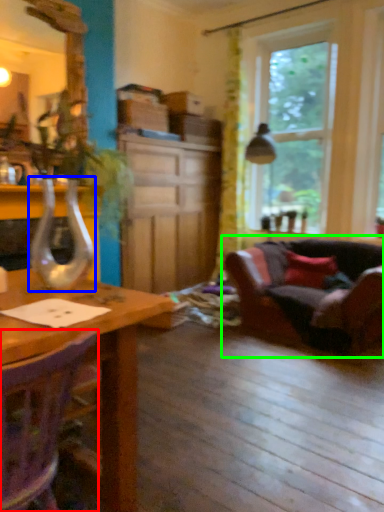
Question: Considering the real-world distances, which object is farthest from chair (highlighted by a red box)? glass vase (highlighted by a blue box) or studio couch (highlighted by a green box)?

Choices:
 (A) glass vase
 (B) studio couch

Answer: (B)